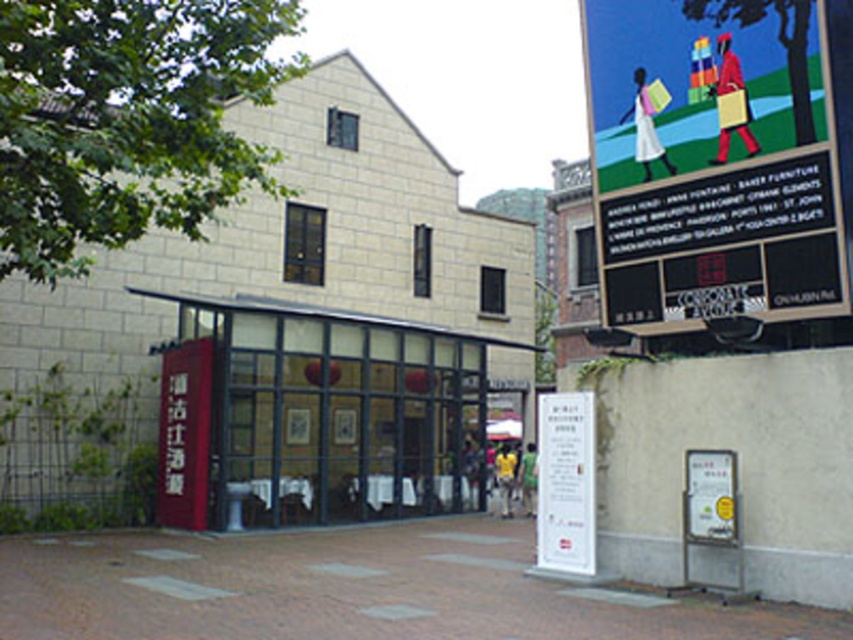
You are a pedestrian passing by the building and notice two signs on the wall. You want to read the white paper sign at center first before the matte blue poster at upper right. Which one should you look at first?

The matte blue poster at upper right is positioned on the right side of the white paper sign at center, so you should look at the white paper sign at center first since it is to the left of the matte blue poster at upper right.

You are a pedestrian standing on the street looking at the building. Which object is nearer to you, the matte blue poster at upper right or the white paper sign at center?

The matte blue poster at upper right is closer to the viewer than the white paper sign at center.

You are a delivery person trying to locate the entrance of the building. You see the matte blue poster at upper right and the white paper sign at center. Which one is closer to the entrance?

The white paper sign at center is closer to the entrance because the distance between the matte blue poster at upper right and the white paper sign at center is 3.32 meters, implying the white paper sign is nearer to the entrance.